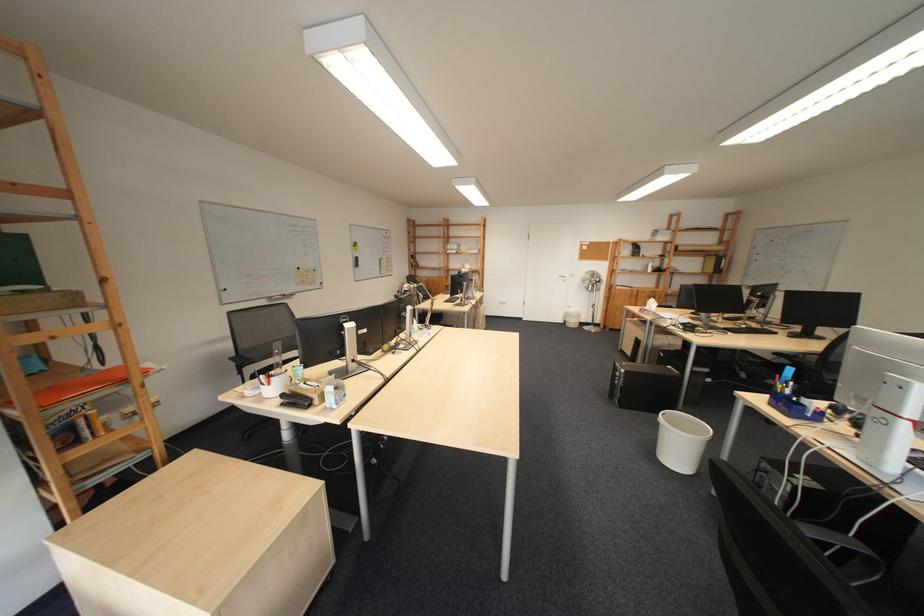
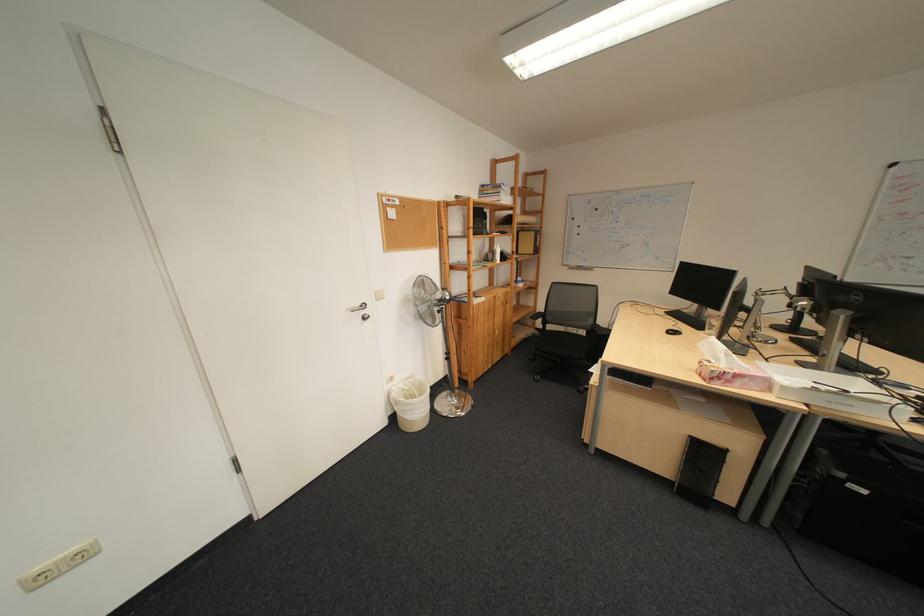
In the second image, find the point that corresponds to [581,310] in the first image.

(402, 386)